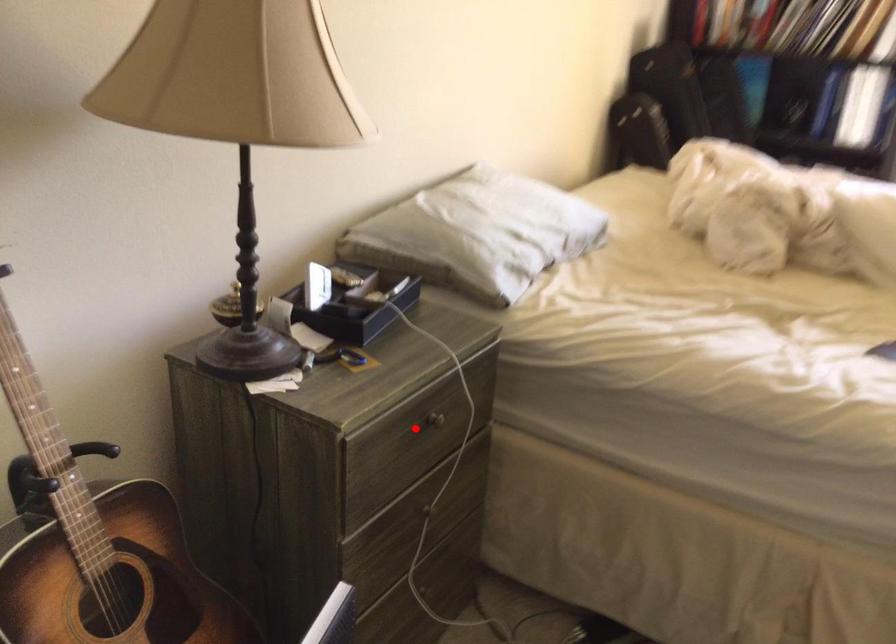
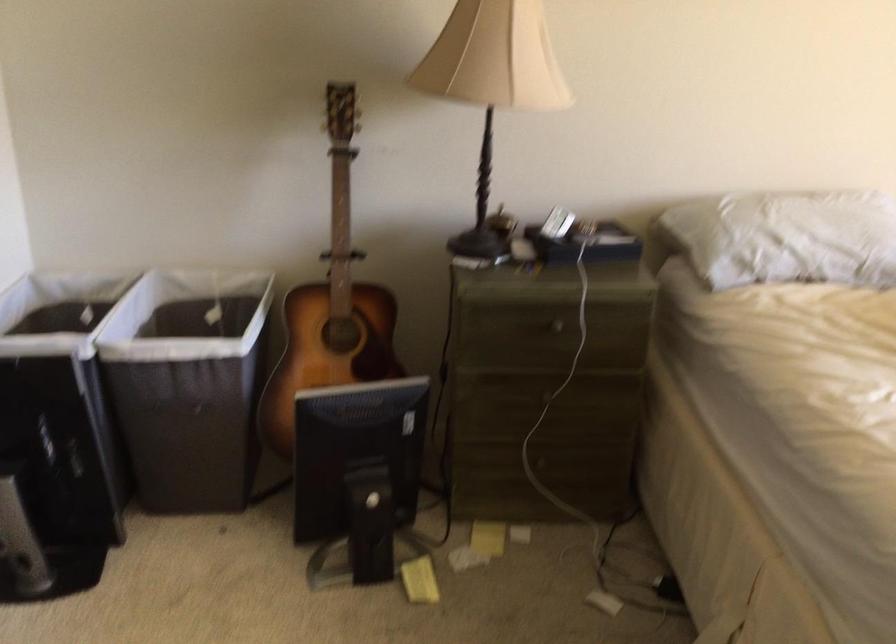
Where in the second image is the point corresponding to the highlighted location from the first image?

(545, 328)